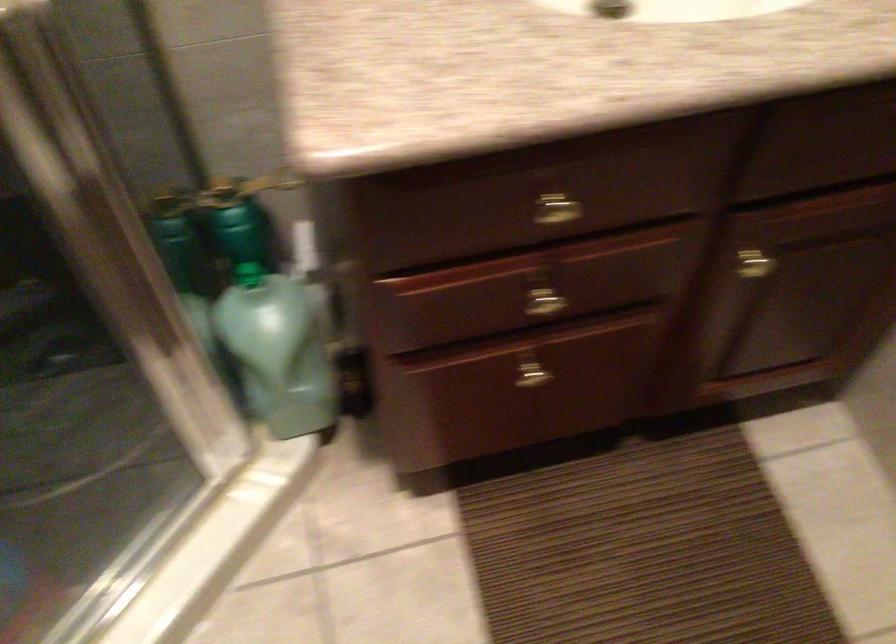
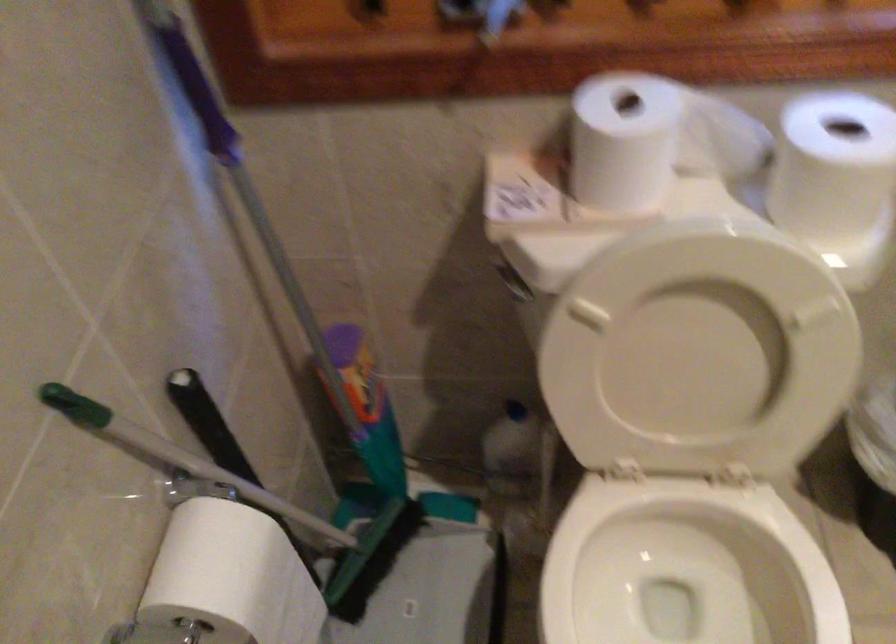
The images are taken continuously from a first-person perspective. In which direction is your viewpoint rotating?

The rotation direction of the camera is left-down.